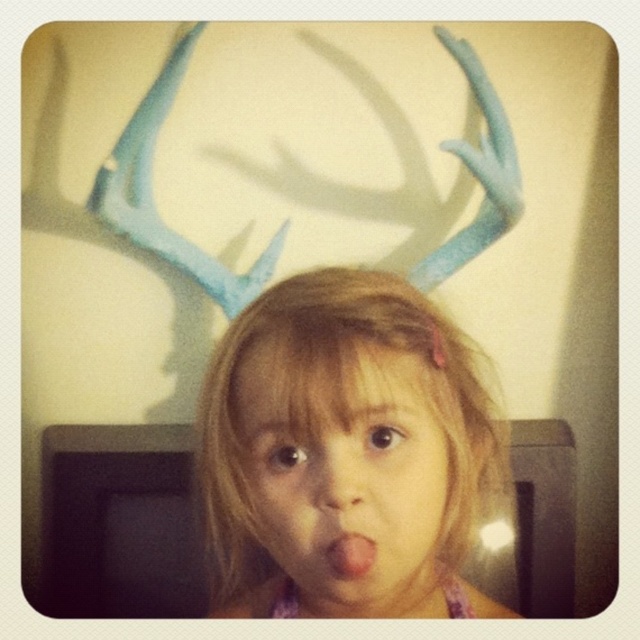
Who is higher up, matte pink hair at center or pink matte tongue at center?

pink matte tongue at center

Who is positioned more to the right, matte pink hair at center or pink matte tongue at center?

matte pink hair at center is more to the right.

What do you see at coordinates (346, 477) in the screenshot? The image size is (640, 640). I see `matte pink hair at center` at bounding box center [346, 477].

Where is `matte pink hair at center`? The width and height of the screenshot is (640, 640). matte pink hair at center is located at coordinates (346, 477).

Is matte pink hair at center wider than smooth skin nose at center?

Yes, matte pink hair at center is wider than smooth skin nose at center.

Find the location of a particular element. This screenshot has height=640, width=640. matte pink hair at center is located at coordinates (346, 477).

Is point (387, 454) less distant than point (346, 464)?

No, it is behind (346, 464).

Find the location of a particular element. matte pink hair at center is located at coordinates (346, 477).

Based on the photo, between smooth skin nose at center and pink matte tongue at center, which one is positioned lower?

pink matte tongue at center is lower down.

Can you confirm if smooth skin nose at center is positioned above pink matte tongue at center?

Yes.

Image resolution: width=640 pixels, height=640 pixels. Describe the element at coordinates (339, 474) in the screenshot. I see `smooth skin nose at center` at that location.

Where is `smooth skin nose at center`? The height and width of the screenshot is (640, 640). smooth skin nose at center is located at coordinates (339, 474).